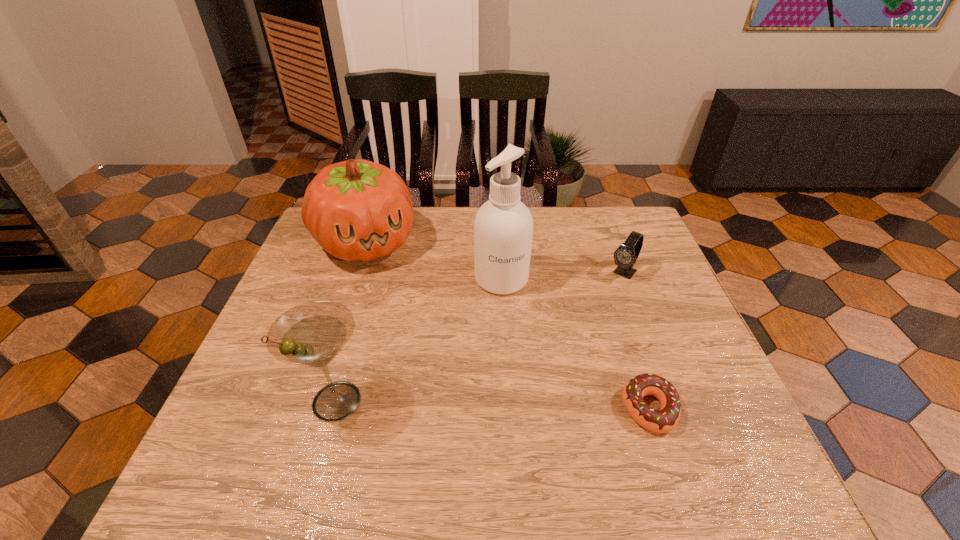
At what (x,y) coordinates should I click in order to perform the action: click on object that stands as the third closest to the cleansing agent. Please return your answer as a coordinate pair (x, y). The width and height of the screenshot is (960, 540). Looking at the image, I should click on (664, 420).

Identify which object is located as the second nearest to the shortest object. Please provide its 2D coordinates. Your answer should be formatted as a tuple, i.e. [(x, y)], where the tuple contains the x and y coordinates of a point satisfying the conditions above.

[(625, 256)]

Locate an element on the screen. free space that satisfies the following two spatial constraints: 1. on the back side of the cleansing agent; 2. on the left side of the martini is located at coordinates (372, 279).

Locate an element on the screen. vacant space that satisfies the following two spatial constraints: 1. on the front side of the pumpkin; 2. on the right side of the second shortest object is located at coordinates (356, 273).